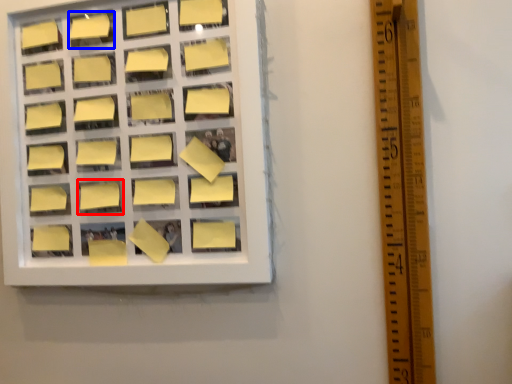
Question: Which point is closer to the camera, square (highlighted by a red box) or square (highlighted by a blue box)?

Choices:
 (A) square
 (B) square

Answer: (A)